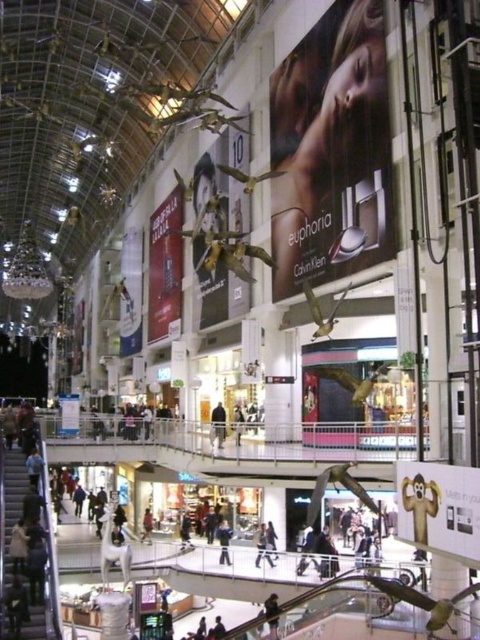
Question: In this image, where is dark blue jeans at lower center located relative to black leather jacket at center?

Choices:
 (A) right
 (B) left

Answer: (A)

Question: Is smooth skin billboard at upper center to the left of black leather jacket at center from the viewer's perspective?

Choices:
 (A) yes
 (B) no

Answer: (B)

Question: Which point is closer to the camera?

Choices:
 (A) blue denim jeans at lower center
 (B) dark blue jeans at lower center
 (C) black leather jacket at center

Answer: (B)

Question: Which point is farther to the camera?

Choices:
 (A) (369, 80)
 (B) (228, 550)

Answer: (B)

Question: Is smooth skin billboard at upper center in front of blue denim jeans at lower center?

Choices:
 (A) yes
 (B) no

Answer: (A)

Question: Which point is farther to the camera?

Choices:
 (A) (228, 525)
 (B) (224, 428)
 (C) (273, 596)
 (D) (325, 99)

Answer: (B)